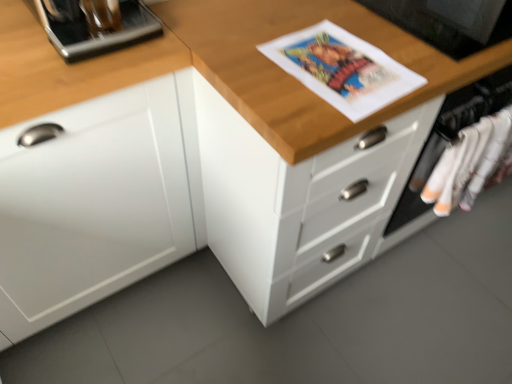
Question: From a real-world perspective, does white cotton socks at right sit lower than metallic silver coffee machine at upper left, which ranks as the second appliance in right-to-left order?

Choices:
 (A) no
 (B) yes

Answer: (B)

Question: Is metallic silver coffee machine at upper left, which ranks as the second appliance in right-to-left order, at the back of white cotton socks at right?

Choices:
 (A) yes
 (B) no

Answer: (B)

Question: Does white cotton socks at right turn towards metallic silver coffee machine at upper left, placed as the first appliance when sorted from left to right?

Choices:
 (A) no
 (B) yes

Answer: (A)

Question: From the image's perspective, is white cotton socks at right over metallic silver coffee machine at upper left, placed as the first appliance when sorted from left to right?

Choices:
 (A) no
 (B) yes

Answer: (A)

Question: Is white cotton socks at right closer to the viewer compared to metallic silver coffee machine at upper left, placed as the first appliance when sorted from left to right?

Choices:
 (A) no
 (B) yes

Answer: (A)

Question: Is the depth of white cotton socks at right greater than that of metallic silver coffee machine at upper left, which ranks as the second appliance in right-to-left order?

Choices:
 (A) no
 (B) yes

Answer: (B)

Question: Is wooden chest of drawers at center a part of metallic silver coffee machine at upper left, placed as the first appliance when sorted from left to right?

Choices:
 (A) yes
 (B) no

Answer: (B)

Question: Does metallic silver coffee machine at upper left, placed as the first appliance when sorted from left to right, appear on the right side of wooden chest of drawers at center?

Choices:
 (A) yes
 (B) no

Answer: (B)

Question: Is metallic silver coffee machine at upper left, placed as the first appliance when sorted from left to right, closer to camera compared to wooden chest of drawers at center?

Choices:
 (A) yes
 (B) no

Answer: (B)

Question: Is metallic silver coffee machine at upper left, which ranks as the second appliance in right-to-left order, behind wooden chest of drawers at center?

Choices:
 (A) yes
 (B) no

Answer: (A)

Question: Could you tell me if metallic silver coffee machine at upper left, which ranks as the second appliance in right-to-left order, is facing wooden chest of drawers at center?

Choices:
 (A) yes
 (B) no

Answer: (B)

Question: From a real-world perspective, does metallic silver coffee machine at upper left, placed as the first appliance when sorted from left to right, stand above wooden chest of drawers at center?

Choices:
 (A) no
 (B) yes

Answer: (B)

Question: Does white matte cabinet at left turn towards black glossy monitor at upper right, marked as the first appliance in a right-to-left arrangement?

Choices:
 (A) yes
 (B) no

Answer: (B)